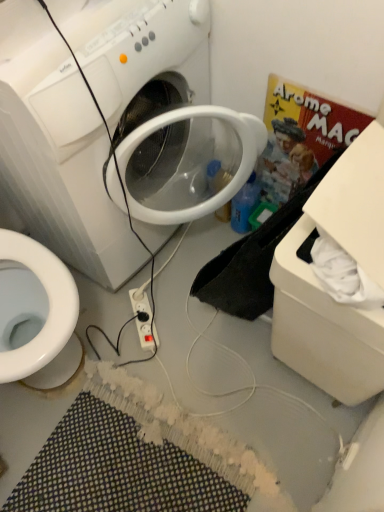
This screenshot has width=384, height=512. What are the coordinates of `white plastic box at lower right` in the screenshot? It's located at (322, 286).

The width and height of the screenshot is (384, 512). What do you see at coordinates (322, 286) in the screenshot? I see `white plastic box at lower right` at bounding box center [322, 286].

Measure the distance between blue plastic bottle at center-right and camera.

The distance of blue plastic bottle at center-right from camera is 1.48 meters.

Where is `white plastic power outlet at center`? white plastic power outlet at center is located at coordinates (144, 320).

Does multicolored woven bath mat at lower center have a smaller size compared to blue plastic bottle at center-right?

Incorrect, multicolored woven bath mat at lower center is not smaller in size than blue plastic bottle at center-right.

From a real-world perspective, who is located lower, multicolored woven bath mat at lower center or blue plastic bottle at center-right?

From a 3D spatial view, multicolored woven bath mat at lower center is below.

Is multicolored woven bath mat at lower center touching blue plastic bottle at center-right?

They are not placed beside each other.

Which is in front, point (89, 483) or point (234, 219)?

The point (89, 483) is in front.

From the image's perspective, is multicolored woven bath mat at lower center above or below white plastic washing machine at center?

Clearly, from the image's perspective, multicolored woven bath mat at lower center is below white plastic washing machine at center.

At what (x,y) coordinates should I click in order to perform the action: click on bath mat on the right of the white plastic washing machine at center. Please return your answer as a coordinate pair (x, y). This screenshot has height=512, width=384. Looking at the image, I should click on (116, 456).

Would you say multicolored woven bath mat at lower center is outside white plastic washing machine at center?

Yes, multicolored woven bath mat at lower center is outside of white plastic washing machine at center.

Is white plastic box at lower right not within white plastic power outlet at center?

Indeed, white plastic box at lower right is completely outside white plastic power outlet at center.

Considering the sizes of objects white plastic box at lower right and white plastic power outlet at center in the image provided, who is thinner, white plastic box at lower right or white plastic power outlet at center?

Thinner between the two is white plastic power outlet at center.

Is point (381, 253) farther from camera compared to point (145, 327)?

No, (381, 253) is closer to viewer.

Is white plastic box at lower right bigger or smaller than white plastic power outlet at center?

Clearly, white plastic box at lower right is larger in size than white plastic power outlet at center.

Are white plastic washing machine at center and blue plastic bottle at center-right located far from each other?

No, white plastic washing machine at center is not far away from blue plastic bottle at center-right.

The height and width of the screenshot is (512, 384). I want to click on bottle that appears below the white plastic washing machine at center (from the image's perspective), so click(x=245, y=204).

From a real-world perspective, which object rests below the other?

blue plastic bottle at center-right.

Is white plastic washing machine at center aimed at blue plastic bottle at center-right?

Yes.

Locate an element on the screen. The width and height of the screenshot is (384, 512). cardboard box located below the white plastic washing machine at center (from the image's perspective) is located at coordinates (322, 286).

Is white plastic washing machine at center bigger than white plastic box at lower right?

Indeed, white plastic washing machine at center has a larger size compared to white plastic box at lower right.

From the image's perspective, which is below, white plastic washing machine at center or white plastic box at lower right?

white plastic box at lower right is shown below in the image.

Locate an element on the screen. The width and height of the screenshot is (384, 512). bath mat below the blue plastic bottle at center-right (from a real-world perspective) is located at coordinates (116, 456).

In the image, is blue plastic bottle at center-right positioned in front of or behind multicolored woven bath mat at lower center?

blue plastic bottle at center-right is positioned farther from the viewer than multicolored woven bath mat at lower center.

Can you tell me how much blue plastic bottle at center-right and multicolored woven bath mat at lower center differ in facing direction?

The angular difference between blue plastic bottle at center-right and multicolored woven bath mat at lower center is 95.7 degrees.

Considering the sizes of objects blue plastic bottle at center-right and multicolored woven bath mat at lower center in the image provided, who is taller, blue plastic bottle at center-right or multicolored woven bath mat at lower center?

Standing taller between the two is blue plastic bottle at center-right.

Considering the relative sizes of white plastic washing machine at center and multicolored woven bath mat at lower center in the image provided, is white plastic washing machine at center bigger than multicolored woven bath mat at lower center?

Correct, white plastic washing machine at center is larger in size than multicolored woven bath mat at lower center.

From a real-world perspective, which object stands above the other?

A: white plastic washing machine at center.

Considering the positions of objects white plastic washing machine at center and multicolored woven bath mat at lower center in the image provided, who is behind, white plastic washing machine at center or multicolored woven bath mat at lower center?

multicolored woven bath mat at lower center is further from the camera.

Is white plastic washing machine at center next to multicolored woven bath mat at lower center and touching it?

white plastic washing machine at center and multicolored woven bath mat at lower center are not in contact.

Identify the location of bath mat that is under the blue plastic bottle at center-right (from a real-world perspective). The image size is (384, 512). (116, 456).

Find the location of a particular element. The height and width of the screenshot is (512, 384). washing machine in front of the multicolored woven bath mat at lower center is located at coordinates (163, 109).

Consider the image. Based on their spatial positions, is multicolored woven bath mat at lower center or white plastic power outlet at center further from white plastic box at lower right?

The object further to white plastic box at lower right is white plastic power outlet at center.

Considering their positions, is multicolored woven bath mat at lower center positioned further to white plastic box at lower right than white plastic washing machine at center?

multicolored woven bath mat at lower center lies further to white plastic box at lower right than the other object.

Estimate the real-world distances between objects in this image. Which object is further from white plastic washing machine at center, multicolored woven bath mat at lower center or blue plastic bottle at center-right?

multicolored woven bath mat at lower center.

Considering their positions, is white plastic washing machine at center positioned further to white plastic box at lower right than white plastic power outlet at center?

The object further to white plastic box at lower right is white plastic power outlet at center.

Looking at the image, which one is located further to multicolored woven bath mat at lower center, white plastic box at lower right or white plastic power outlet at center?

white plastic box at lower right is positioned further to the anchor multicolored woven bath mat at lower center.

When comparing their distances from white plastic power outlet at center, does white plastic washing machine at center or white plastic box at lower right seem closer?

white plastic washing machine at center.

Which object lies nearer to the anchor point multicolored woven bath mat at lower center, white plastic box at lower right or blue plastic bottle at center-right?

The object closer to multicolored woven bath mat at lower center is white plastic box at lower right.

Considering their positions, is white plastic power outlet at center positioned further to white plastic washing machine at center than multicolored woven bath mat at lower center?

The object further to white plastic washing machine at center is multicolored woven bath mat at lower center.

Where is `washing machine located between white plastic box at lower right and blue plastic bottle at center-right in the depth direction`? washing machine located between white plastic box at lower right and blue plastic bottle at center-right in the depth direction is located at coordinates (163, 109).

Locate an element on the screen. Image resolution: width=384 pixels, height=512 pixels. cardboard box between blue plastic bottle at center-right and multicolored woven bath mat at lower center in the vertical direction is located at coordinates (322, 286).

Where is `bottle between white plastic washing machine at center and multicolored woven bath mat at lower center in the vertical direction`? Image resolution: width=384 pixels, height=512 pixels. bottle between white plastic washing machine at center and multicolored woven bath mat at lower center in the vertical direction is located at coordinates (245, 204).

Where is `power outlet between white plastic box at lower right and blue plastic bottle at center-right in the front-back direction`? Image resolution: width=384 pixels, height=512 pixels. power outlet between white plastic box at lower right and blue plastic bottle at center-right in the front-back direction is located at coordinates (144, 320).